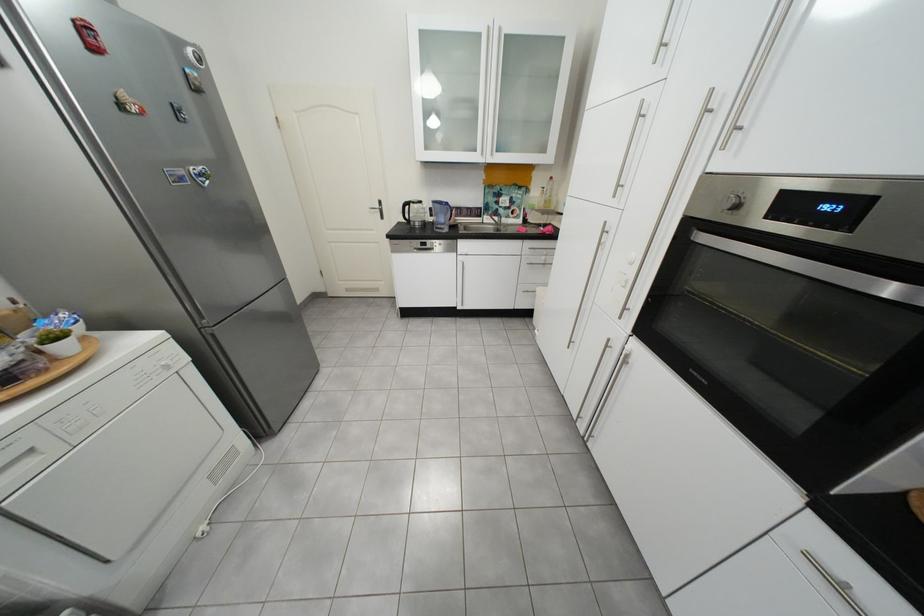
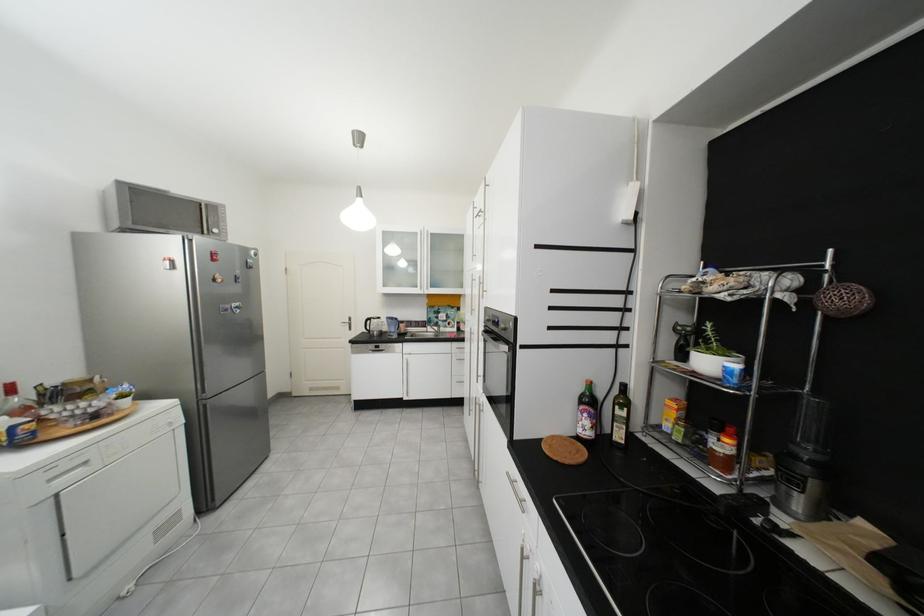
Find the pixel in the second image that matches pixel 193 180 in the first image.

(237, 310)